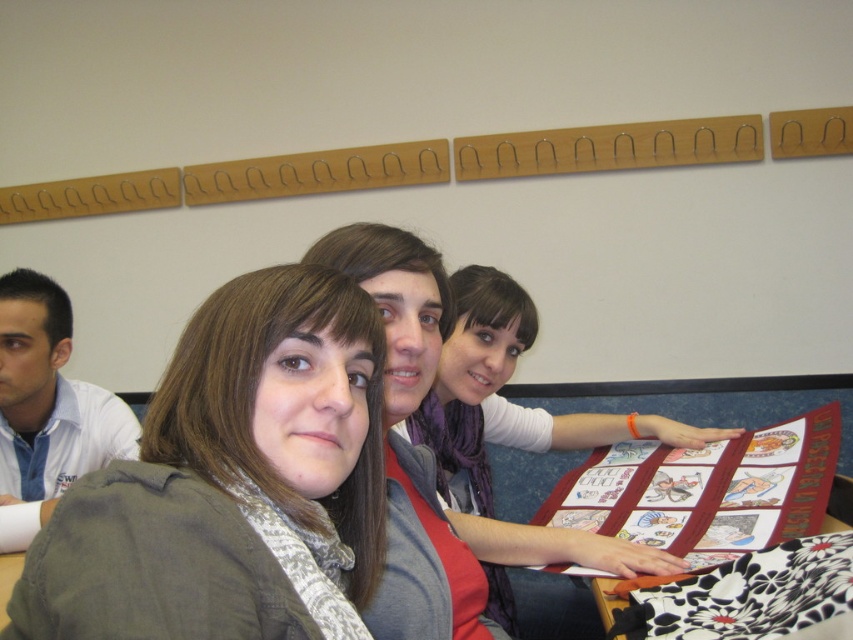
Question: Can you confirm if matte gray scarf at left is thinner than black floral fabric at lower right?

Choices:
 (A) no
 (B) yes

Answer: (B)

Question: In this image, where is matte gray scarf at left located relative to black floral fabric at lower right?

Choices:
 (A) above
 (B) below

Answer: (A)

Question: Which object appears closest to the camera in this image?

Choices:
 (A) matte gray jacket at center
 (B) red fabric quilt at center
 (C) matte gray scarf at left
 (D) matte gray scarf at center

Answer: (A)

Question: Which of the following is the farthest from the observer?

Choices:
 (A) (811, 458)
 (B) (445, 608)
 (C) (782, 582)
 (D) (468, 298)

Answer: (A)

Question: Which object appears farthest from the camera in this image?

Choices:
 (A) matte gray jacket at center
 (B) matte gray scarf at left

Answer: (B)

Question: Is matte gray jacket at center to the left of black floral fabric at lower right from the viewer's perspective?

Choices:
 (A) yes
 (B) no

Answer: (A)